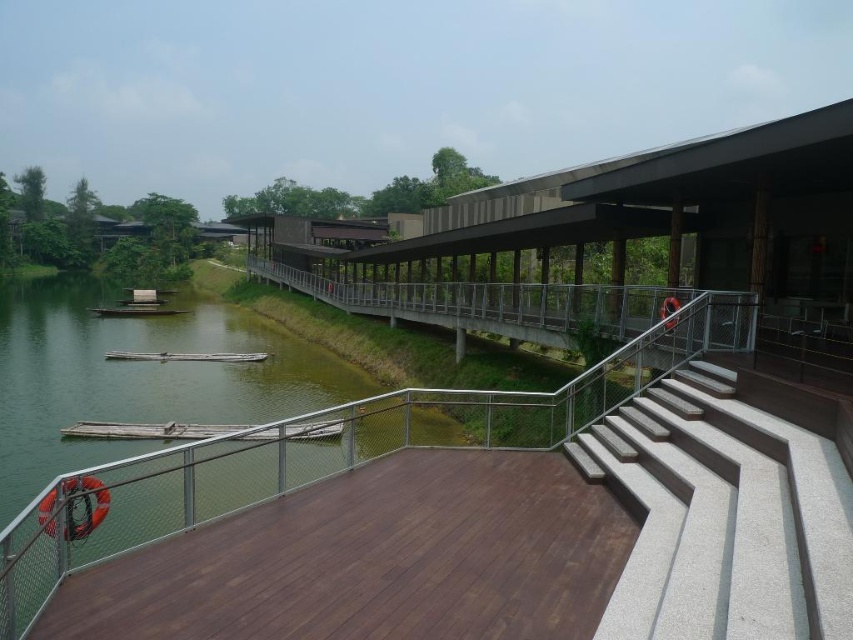
Question: Does brown wood deck at lower left have a larger size compared to gray concrete stairs at right?

Choices:
 (A) no
 (B) yes

Answer: (A)

Question: Is brown wood deck at lower left further to the viewer compared to gray concrete stairs at right?

Choices:
 (A) no
 (B) yes

Answer: (B)

Question: Can you confirm if brown wood deck at lower left is bigger than gray concrete stairs at right?

Choices:
 (A) no
 (B) yes

Answer: (A)

Question: Which object appears closest to the camera in this image?

Choices:
 (A) brown wood deck at lower left
 (B) gray concrete stairs at right

Answer: (B)